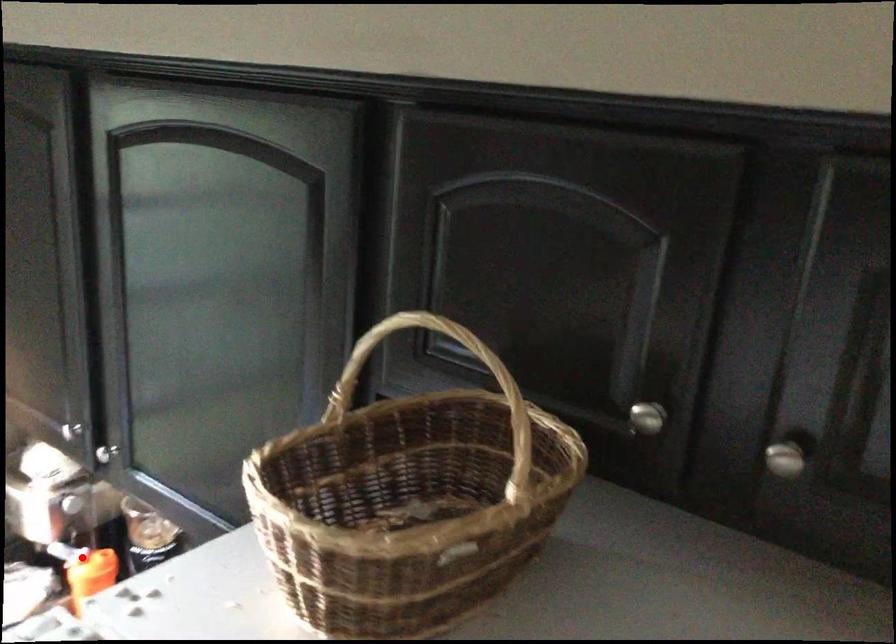
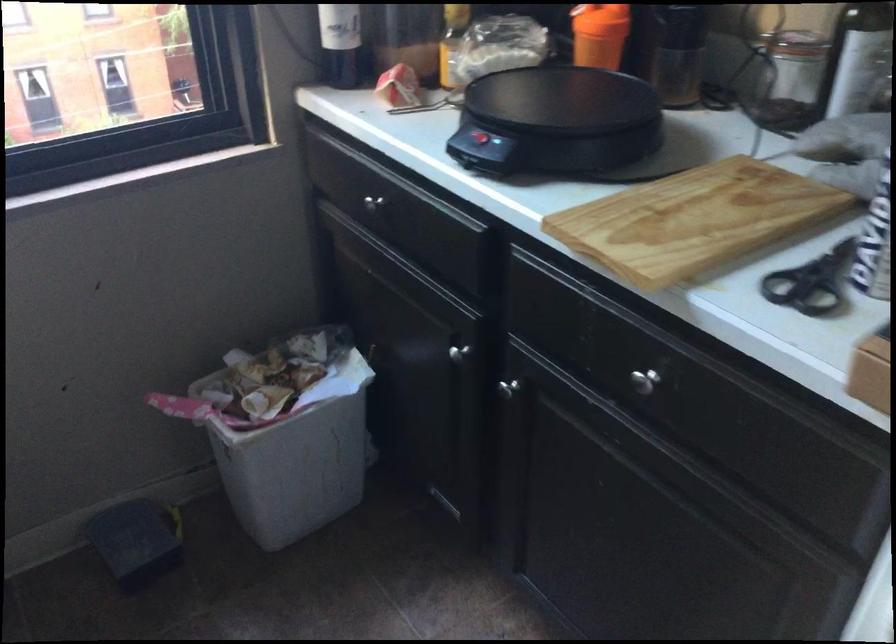
Find the pixel in the second image that matches the highlighted location in the first image.

(599, 35)